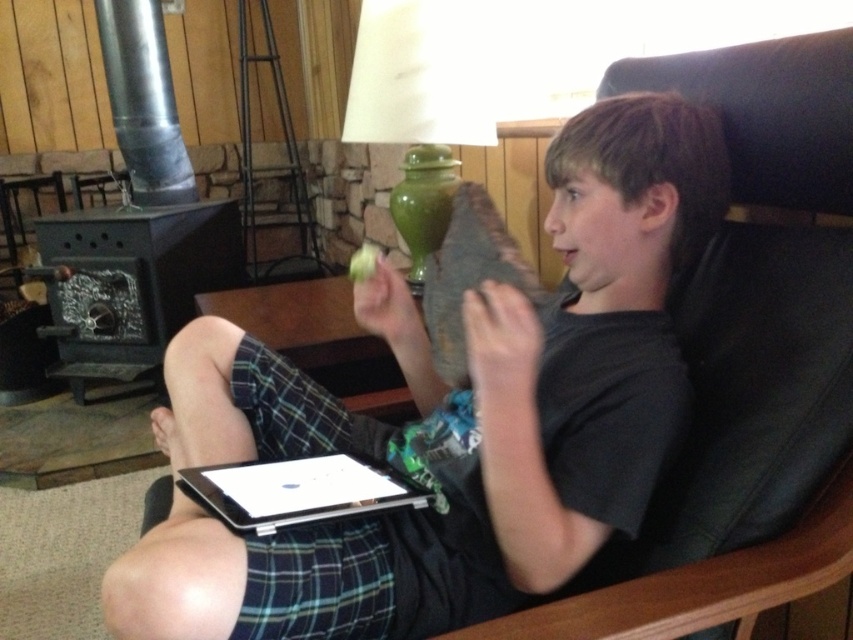
Question: Is green ceramic lamp at upper center above silver metallic laptop at lower center?

Choices:
 (A) yes
 (B) no

Answer: (A)

Question: Does black matte shirt at center have a smaller size compared to silver metallic laptop at lower center?

Choices:
 (A) yes
 (B) no

Answer: (B)

Question: Among these objects, which one is farthest from the camera?

Choices:
 (A) silver metallic laptop at lower center
 (B) black matte shirt at center
 (C) green ceramic lamp at upper center

Answer: (C)

Question: Which of these objects is positioned farthest from the silver metallic laptop at lower center?

Choices:
 (A) black matte shirt at center
 (B) green ceramic lamp at upper center

Answer: (B)

Question: Can you confirm if black matte shirt at center is positioned below silver metallic laptop at lower center?

Choices:
 (A) no
 (B) yes

Answer: (A)

Question: Which of these objects is positioned closest to the black matte shirt at center?

Choices:
 (A) silver metallic laptop at lower center
 (B) green ceramic lamp at upper center

Answer: (A)